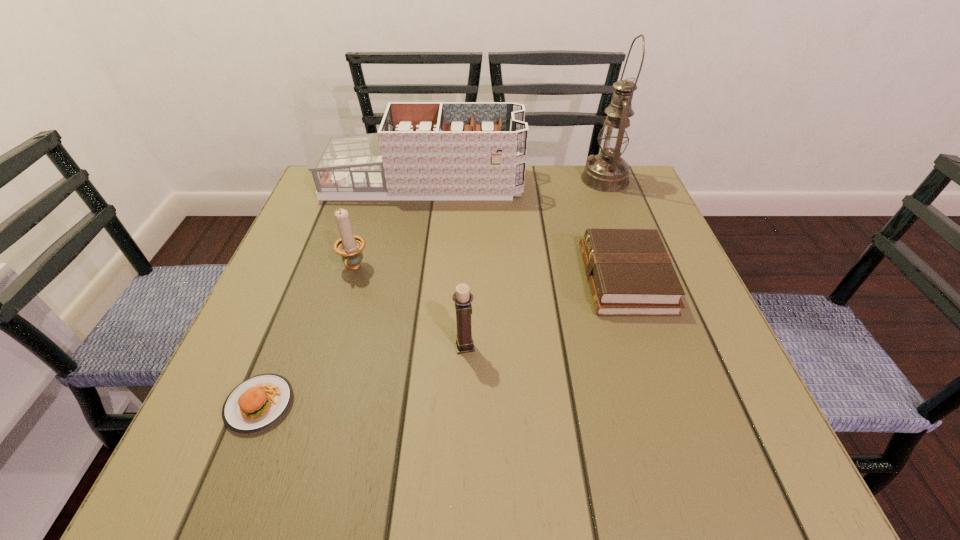
Locate an element on the screen. The image size is (960, 540). the tallest object is located at coordinates (607, 172).

Locate an element on the screen. The height and width of the screenshot is (540, 960). dollhouse is located at coordinates (423, 150).

At what (x,y) coordinates should I click in order to perform the action: click on the nearer candle_holder. Please return your answer as a coordinate pair (x, y). The width and height of the screenshot is (960, 540). Looking at the image, I should click on (462, 298).

Where is `the second nearest object`? The height and width of the screenshot is (540, 960). the second nearest object is located at coordinates (462, 298).

Locate an element on the screen. the farther candle_holder is located at coordinates (349, 246).

The height and width of the screenshot is (540, 960). In order to click on the second shortest object in this screenshot , I will do `click(630, 273)`.

At what (x,y) coordinates should I click in order to perform the action: click on the nearest object. Please return your answer as a coordinate pair (x, y). The width and height of the screenshot is (960, 540). Looking at the image, I should click on (257, 403).

This screenshot has height=540, width=960. I want to click on the shortest object, so click(257, 403).

Where is `vacant space located 0.270m on the front of the oil lamp`? The image size is (960, 540). vacant space located 0.270m on the front of the oil lamp is located at coordinates (636, 263).

Image resolution: width=960 pixels, height=540 pixels. What are the coordinates of `free region located 0.050m at the entrance of the fifth shortest object` in the screenshot? It's located at (541, 184).